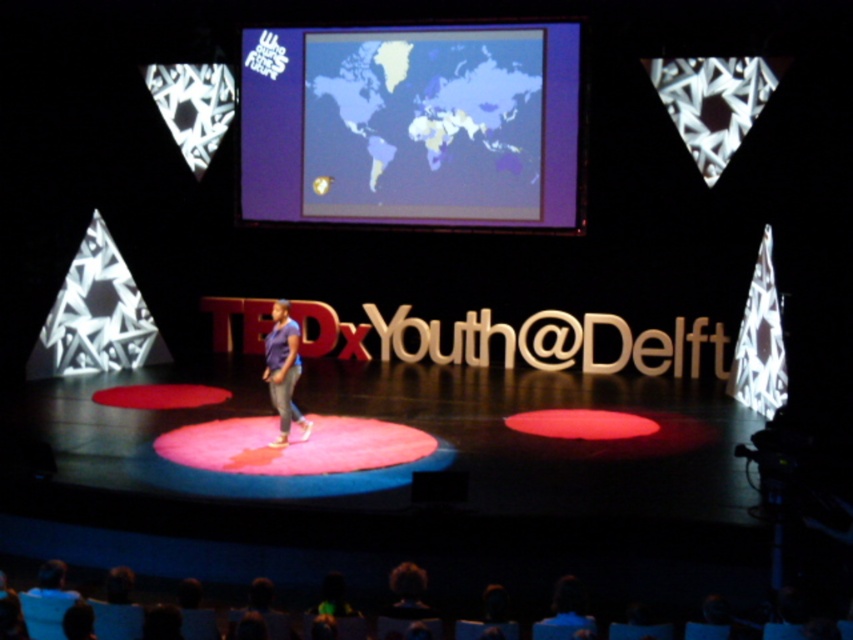
Can you confirm if matte plastic map at upper center is bigger than matte purple shirt at center?

Indeed, matte plastic map at upper center has a larger size compared to matte purple shirt at center.

How far apart are matte plastic map at upper center and matte purple shirt at center?

matte plastic map at upper center is 4.07 meters from matte purple shirt at center.

The image size is (853, 640). What do you see at coordinates (410, 125) in the screenshot? I see `matte plastic map at upper center` at bounding box center [410, 125].

Identify the location of matte plastic map at upper center. (410, 125).